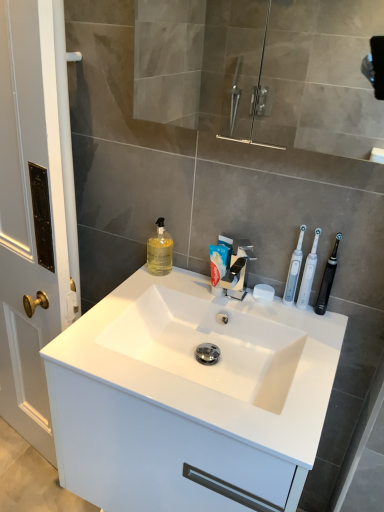
What are the coordinates of `vacant space in between white matte toothpaste at center and translucent yellow liquid at sink left` in the screenshot? It's located at (186, 281).